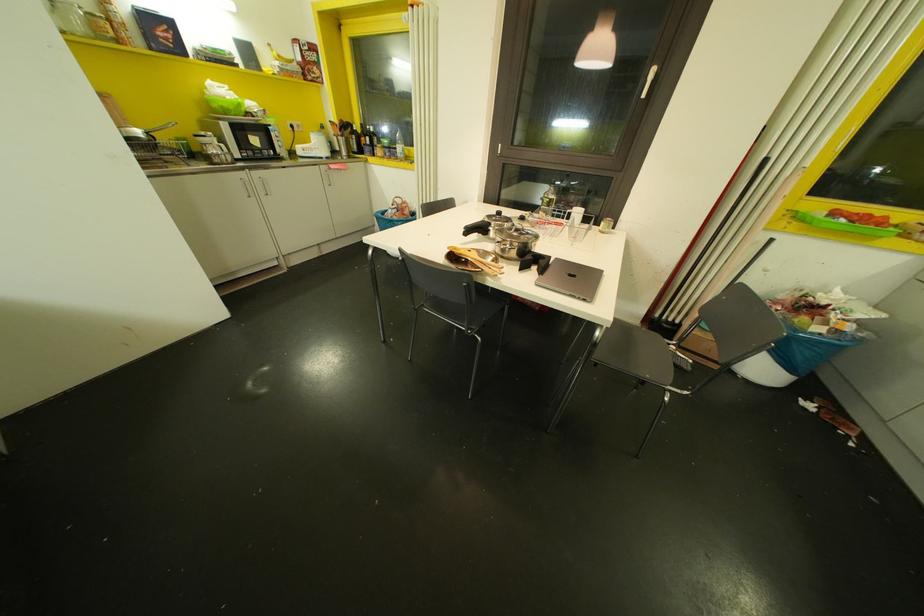
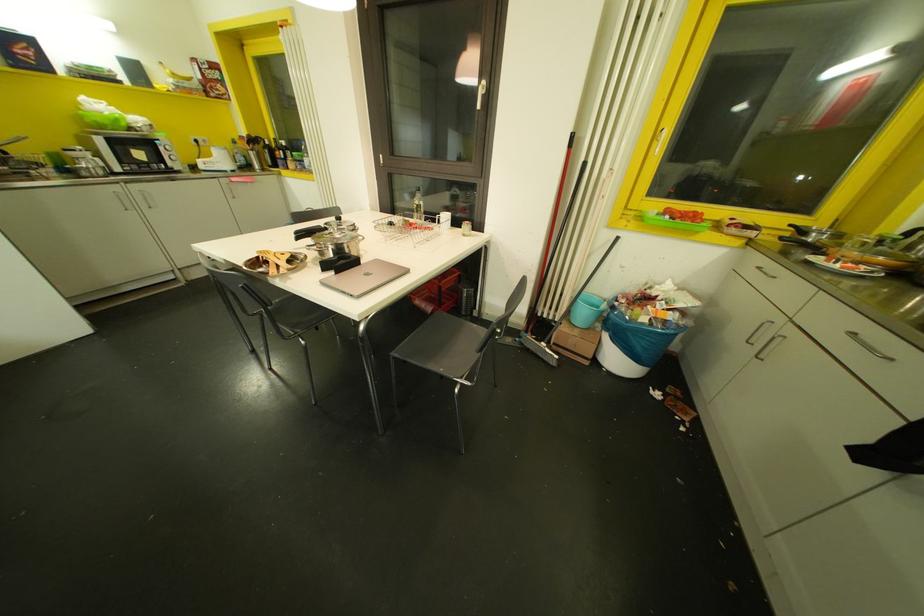
Where in the second image is the point corresponding to point 651,71 from the first image?

(481, 81)